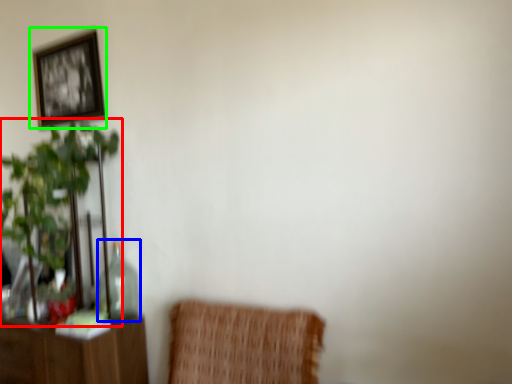
Question: Considering the real-world distances, which object is farthest from houseplant (highlighted by a red box)? glass vase (highlighted by a blue box) or picture frame (highlighted by a green box)?

Choices:
 (A) glass vase
 (B) picture frame

Answer: (B)